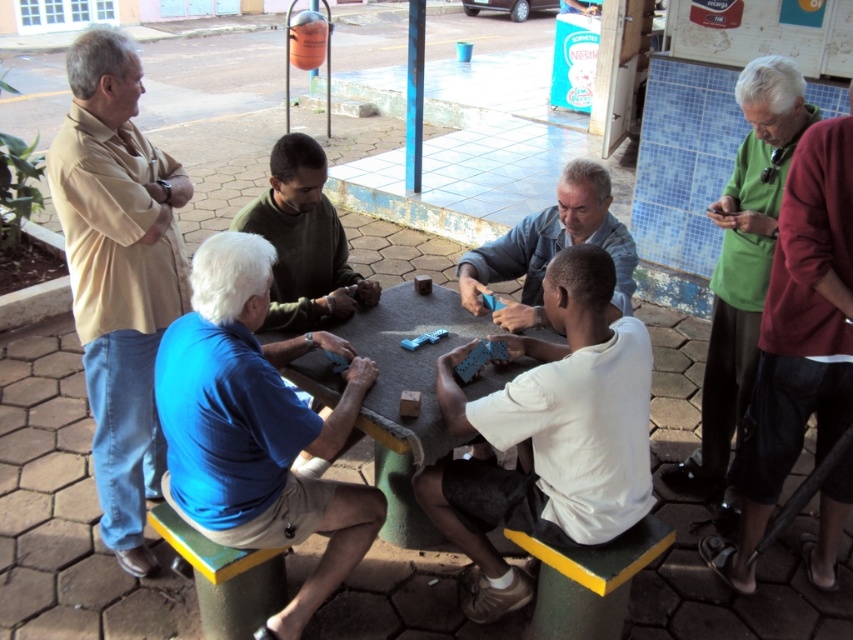
You are standing at the edge of the patio and want to walk towards the two points marked in the image. Which point, point (386, 406) or point (314, 253), will you reach first?

Point (386, 406) is closer to the viewer than point (314, 253), so you will reach point (386, 406) first.

What object is located at the coordinates point (399, 397) in the image?

The smooth gray table at center is located at point (399, 397).

You are standing at the edge of the patio and want to greet the person wearing the blue cotton shirt at lower left and the person wearing the white matte shirt at center. Which direction should you walk to reach the first person compared to the second one?

The blue cotton shirt at lower left is to the left of white matte shirt at center, so you should walk towards the left side of the patio to reach the blue cotton shirt at lower left before the white matte shirt at center.